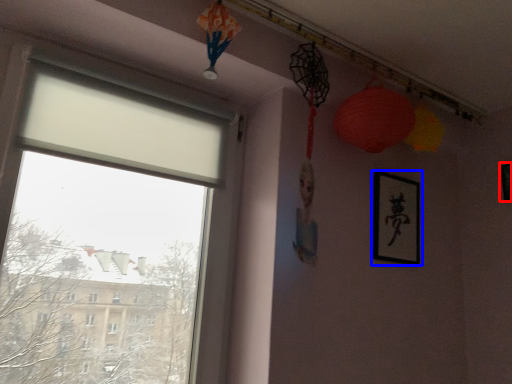
Question: Which object is further to the camera taking this photo, picture frame (highlighted by a red box) or picture frame (highlighted by a blue box)?

Choices:
 (A) picture frame
 (B) picture frame

Answer: (A)